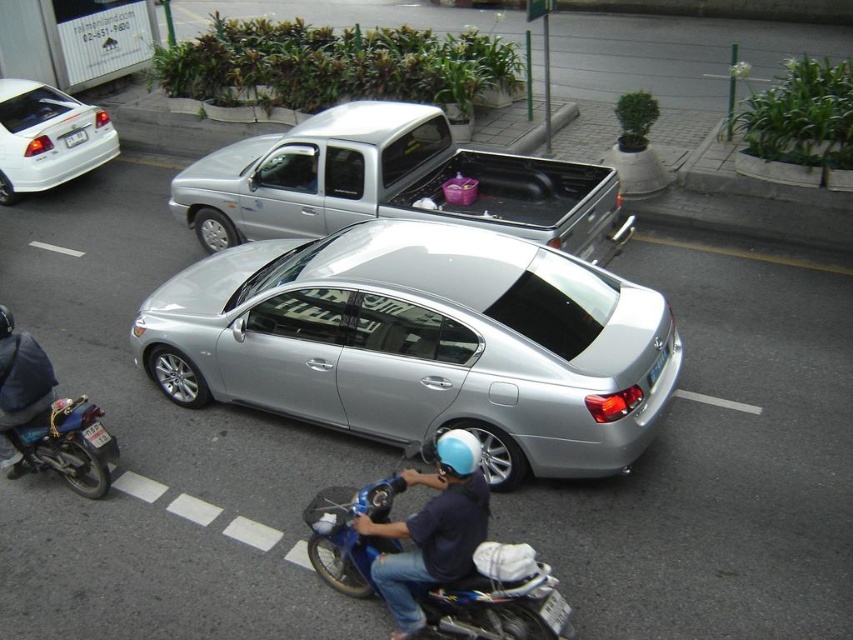
Question: Is blue matte helmet at center positioned before white plastic license plate at upper left?

Choices:
 (A) yes
 (B) no

Answer: (A)

Question: Is blue metallic motorcycle at lower center to the right of white plastic license plate at upper left from the viewer's perspective?

Choices:
 (A) no
 (B) yes

Answer: (B)

Question: Which of the following is the farthest from the observer?

Choices:
 (A) (483, 602)
 (B) (363, 172)
 (C) (44, 145)

Answer: (C)

Question: Considering the real-world distances, which object is closest to the blue metallic motorcycle at lower center?

Choices:
 (A) silver metallic pickup truck at center
 (B) blue matte helmet at center
 (C) white glossy sedan at upper left

Answer: (B)

Question: Which point is farther to the camera?

Choices:
 (A) (631, 330)
 (B) (51, 99)
 (C) (368, 502)
 (D) (68, 134)

Answer: (B)

Question: Observing the image, what is the correct spatial positioning of white plastic license plate at lower left in reference to white plastic license plate at upper left?

Choices:
 (A) above
 (B) below

Answer: (B)